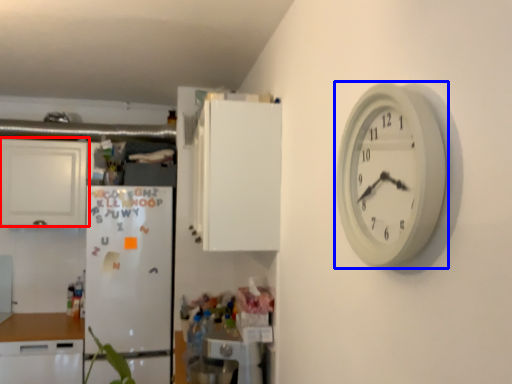
Question: Which object appears closest to the camera in this image, cabinetry (highlighted by a red box) or wall clock (highlighted by a blue box)?

Choices:
 (A) cabinetry
 (B) wall clock

Answer: (B)